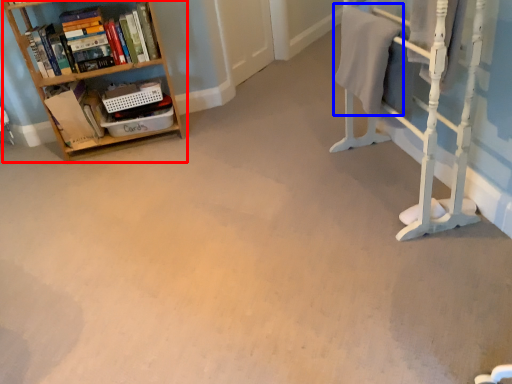
Question: Which object is closer to the camera taking this photo, shelf (highlighted by a red box) or bath towel (highlighted by a blue box)?

Choices:
 (A) shelf
 (B) bath towel

Answer: (B)